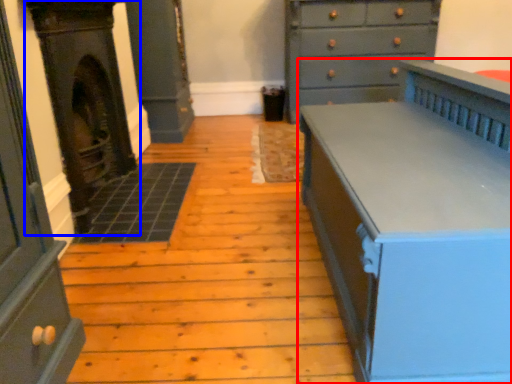
Question: Which object appears closest to the camera in this image, chest of drawers (highlighted by a red box) or fireplace (highlighted by a blue box)?

Choices:
 (A) chest of drawers
 (B) fireplace

Answer: (A)